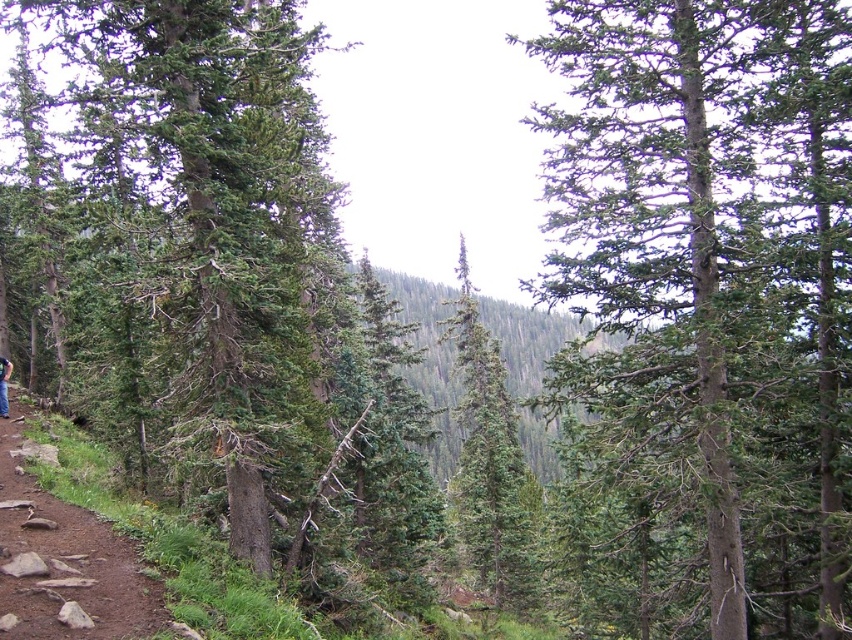
Question: Considering the relative positions of green rough bark tree at center and dirt path at lower left in the image provided, where is green rough bark tree at center located with respect to dirt path at lower left?

Choices:
 (A) below
 (B) above

Answer: (B)

Question: Does dirt path at lower left have a smaller size compared to blue fabric hiker at lower left?

Choices:
 (A) no
 (B) yes

Answer: (A)

Question: Which object appears farthest from the camera in this image?

Choices:
 (A) green matte tree at center
 (B) green rough bark tree at center
 (C) dirt path at lower left

Answer: (A)

Question: Which object appears closest to the camera in this image?

Choices:
 (A) green matte tree at center
 (B) green rough bark tree at center
 (C) dirt path at lower left
 (D) blue fabric hiker at lower left

Answer: (C)

Question: Which is farther from the green rough bark tree at center?

Choices:
 (A) dirt path at lower left
 (B) blue fabric hiker at lower left
 (C) green matte tree at center

Answer: (B)

Question: Considering the relative positions of green rough bark tree at center and green matte tree at center in the image provided, where is green rough bark tree at center located with respect to green matte tree at center?

Choices:
 (A) below
 (B) above

Answer: (B)